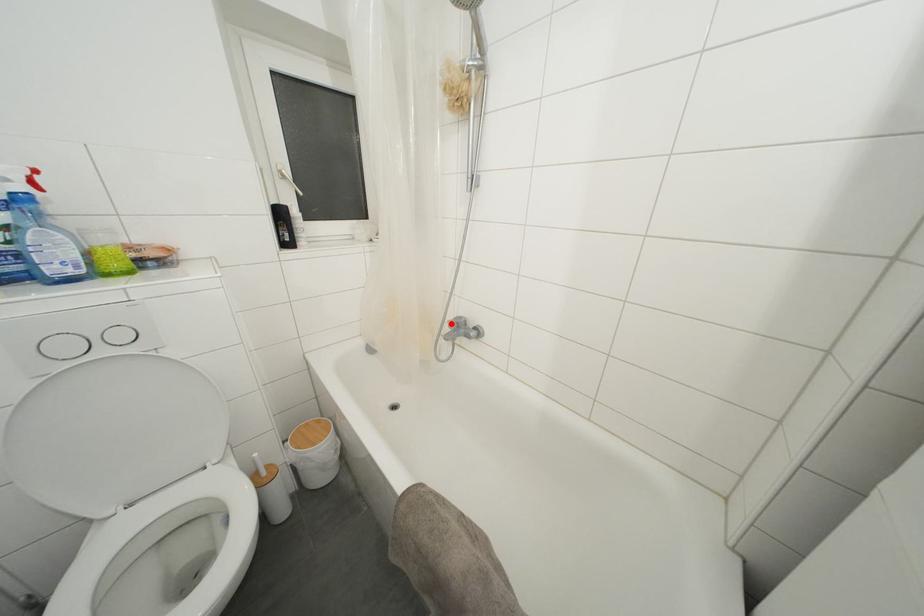
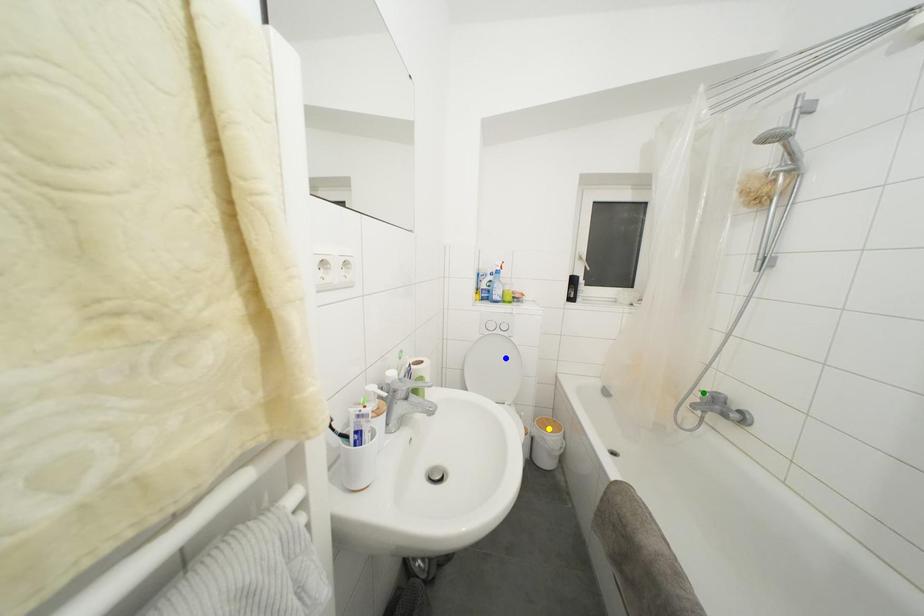
Question: I am providing you with two images of the same scene from different viewpoints. A red point is marked on the first image. You are given multiple points on the second image. Which mark in image 2 goes with the point in image 1?

Choices:
 (A) green point
 (B) blue point
 (C) yellow point

Answer: (A)